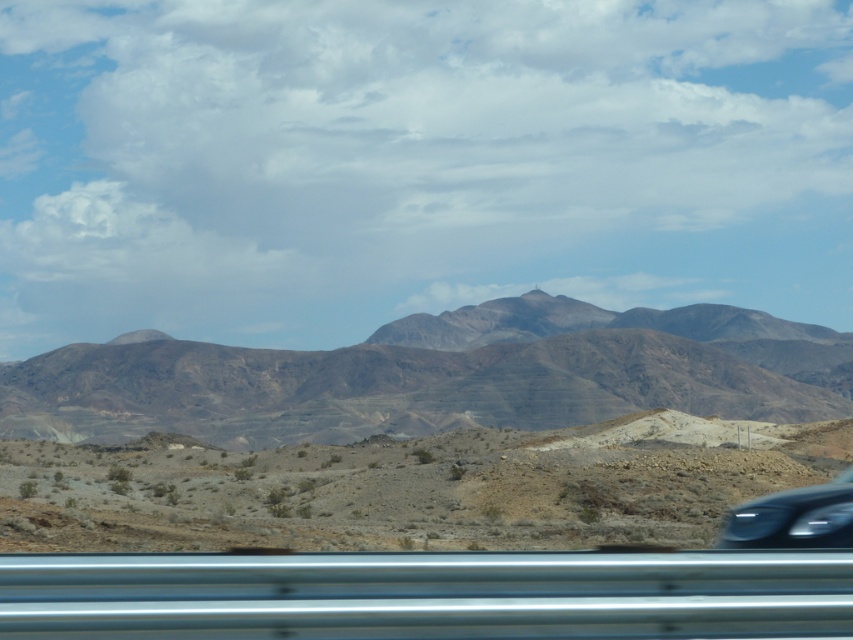
Question: Which point is closer to the camera taking this photo?

Choices:
 (A) (416, 451)
 (B) (848, 541)

Answer: (B)

Question: Can you confirm if brown rocky mountain range at center is wider than metallic silver car window at bottom?

Choices:
 (A) no
 (B) yes

Answer: (B)

Question: In this image, where is brown rocky mountain range at center located relative to metallic silver car window at bottom?

Choices:
 (A) right
 (B) left

Answer: (B)

Question: Which object is farther from the camera taking this photo?

Choices:
 (A) sleek black car at lower right
 (B) brown rocky mountain range at center

Answer: (B)

Question: Which object is closer to the camera taking this photo?

Choices:
 (A) sleek black car at lower right
 (B) brown rocky mountain range at center
 (C) metallic silver car window at bottom
 (D) desert at center

Answer: (C)

Question: Is metallic silver car window at bottom wider than sleek black car at lower right?

Choices:
 (A) no
 (B) yes

Answer: (A)